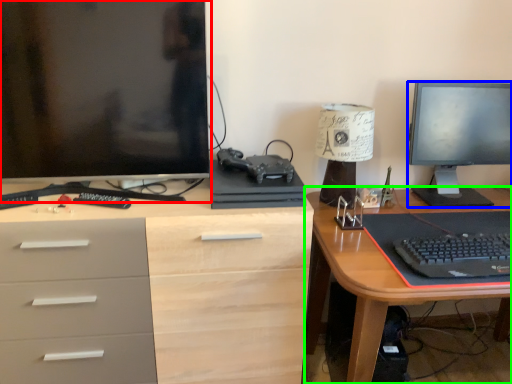
Question: Which is farther away from computer monitor (highlighted by a red box)? television (highlighted by a blue box) or desk (highlighted by a green box)?

Choices:
 (A) television
 (B) desk

Answer: (A)